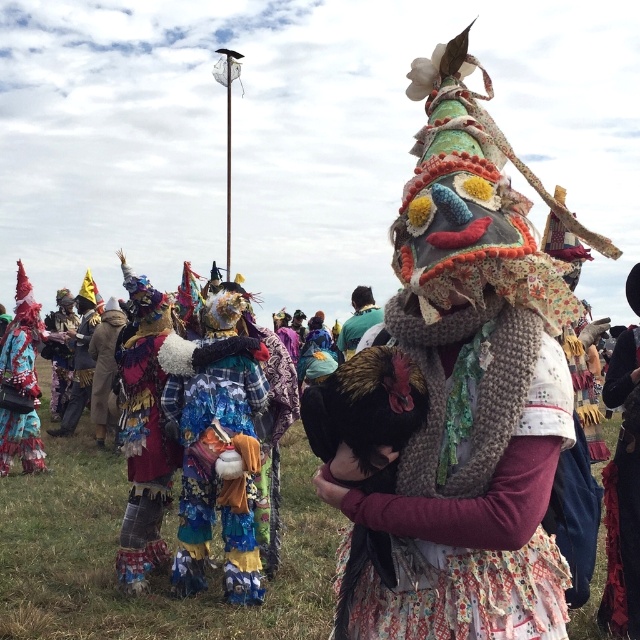
Is knitted scarf at center taller than multicolored fabric at center?

No.

How far apart are knitted scarf at center and multicolored fabric at center?

They are 2.73 meters apart.

Is point (520, 541) positioned after point (214, 372)?

No, (520, 541) is in front of (214, 372).

At what (x,y) coordinates should I click in order to perform the action: click on knitted scarf at center. Please return your answer as a coordinate pair (x, y). Looking at the image, I should click on (472, 536).

Describe the element at coordinates (472, 536) in the screenshot. I see `knitted scarf at center` at that location.

Which is in front, point (509, 570) or point (38, 333)?

Point (509, 570)

Is point (408, 540) farther from viewer compared to point (13, 412)?

That is False.

Locate an element on the screen. knitted scarf at center is located at coordinates (472, 536).

Between multicolored fabric at center and shiny red fabric at left, which one is positioned lower?

multicolored fabric at center

The height and width of the screenshot is (640, 640). Identify the location of multicolored fabric at center. (218, 472).